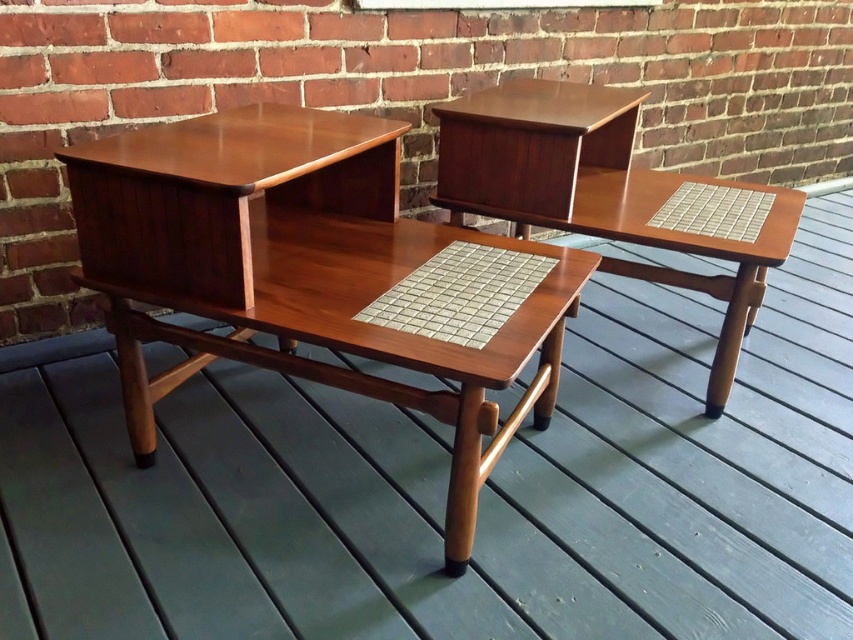
You are standing 5 feet away from the wooden deck where the mid century modern furniture is placed. There is a point at coordinates point (310, 156). Can you reach that point without moving closer than 4 feet to the deck?

The distance of point (310, 156) from viewer is 4.09 feet, so you are currently 5 feet away. Since 4.09 feet is less than 5 feet, the point is closer to you than your current position. However, the requirement is to not move closer than 4 feet. Since 4.09 feet is just slightly over 4 feet, you cannot reach it without moving closer than 4 feet because you need to be within 4.09 feet to touch it, which exceeds the 4 feet limit.

You are standing on the wooden deck looking at the mid century modern furniture. There are two points marked on the deck, point (x=215, y=116) and point (x=592, y=170). Which point is closer to you?

Point (x=215, y=116) is in front of point (x=592, y=170), so it is closer to you.